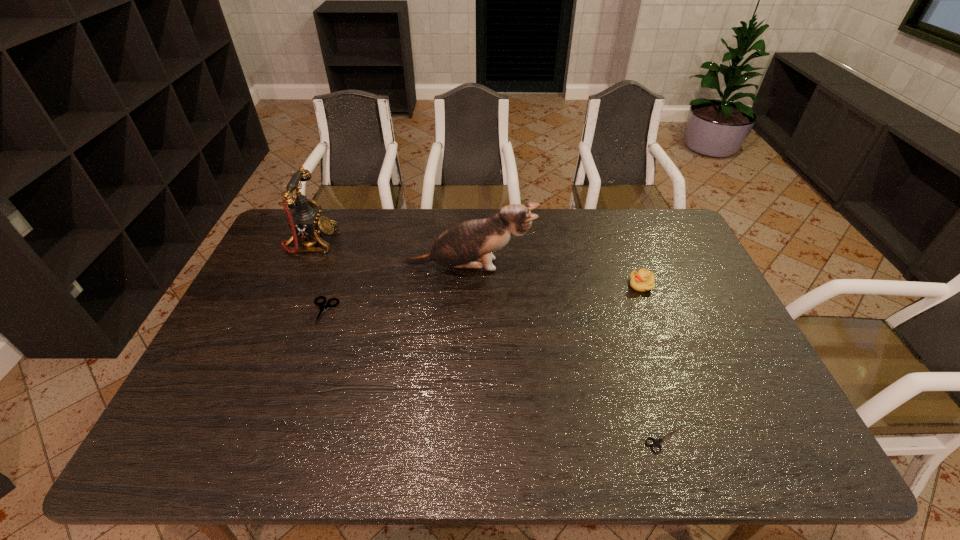
At what (x,y) coordinates should I click in order to perform the action: click on vacant area in the image that satisfies the following two spatial constraints: 1. at the face of the nearer shears; 2. on the right side of the third object from right to left. Please return your answer as a coordinate pair (x, y). The height and width of the screenshot is (540, 960). Looking at the image, I should click on (467, 440).